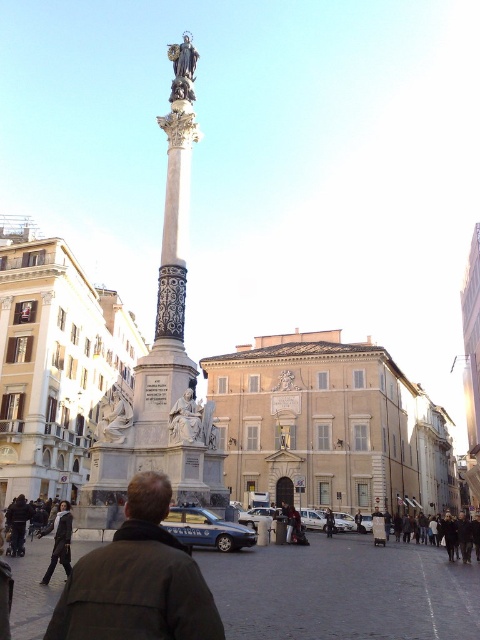
You are standing in the urban square and want to take a photo that includes both the monument and the point at coordinates point [179,68] and point [326,532]. Which point is closer to you, the photographer, so you can adjust your framing?

Point [179,68] is closer to the viewer than point [326,532], so you should position yourself closer to the monument to include both points in your photo while ensuring the closer point remains in frame.